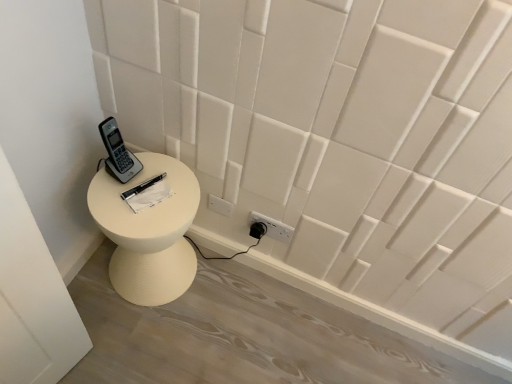
You are a GUI agent. You are given a task and a screenshot of the screen. Output one action in this format:
    pyautogui.click(x=<x>, y=<y>)
    Task: Click on the white paper at center
    
    Given the screenshot: What is the action you would take?
    pyautogui.click(x=149, y=196)

Describe the element at coordinates (148, 232) in the screenshot. The height and width of the screenshot is (384, 512). I see `white matte side table at lower left` at that location.

The image size is (512, 384). I want to click on white paper at center, so click(x=149, y=196).

From the image's perspective, which is below, gray plastic phone at upper left or white paper at center?

white paper at center is shown below in the image.

From a real-world perspective, who is located lower, gray plastic phone at upper left or white paper at center?

From a 3D spatial view, white paper at center is below.

Considering the sizes of objects gray plastic phone at upper left and white paper at center in the image provided, who is thinner, gray plastic phone at upper left or white paper at center?

gray plastic phone at upper left.

Considering the sizes of objects white paper at center and gray plastic phone at upper left in the image provided, who is shorter, white paper at center or gray plastic phone at upper left?

Standing shorter between the two is white paper at center.

Considering the sizes of objects white paper at center and gray plastic phone at upper left in the image provided, who is wider, white paper at center or gray plastic phone at upper left?

With larger width is white paper at center.

From a real-world perspective, is white paper at center beneath gray plastic phone at upper left?

Yes, from a real-world perspective, white paper at center is below gray plastic phone at upper left.

Is white paper at center oriented towards gray plastic phone at upper left?

No, white paper at center is not facing towards gray plastic phone at upper left.

I want to click on notepad that appears above the white matte side table at lower left (from the image's perspective), so click(149, 196).

Which is closer, (145, 194) or (185, 175)?

The point (145, 194) is closer to the camera.

From a real-world perspective, which is physically below, white paper at center or white matte side table at lower left?

From a 3D spatial view, white matte side table at lower left is below.

Which of these two, white matte side table at lower left or gray plastic phone at upper left, stands taller?

white matte side table at lower left.

From the image's perspective, between white matte side table at lower left and gray plastic phone at upper left, which one is located above?

gray plastic phone at upper left appears higher in the image.

Which object is more forward, white matte side table at lower left or gray plastic phone at upper left?

gray plastic phone at upper left is more forward.

Which object is positioned more to the right, white matte side table at lower left or gray plastic phone at upper left?

From the viewer's perspective, white matte side table at lower left appears more on the right side.

Looking at this image, from the image's perspective, which is below, white matte side table at lower left or white paper at center?

white matte side table at lower left, from the image's perspective.

Considering the sizes of white matte side table at lower left and white paper at center in the image, is white matte side table at lower left bigger or smaller than white paper at center?

Considering their sizes, white matte side table at lower left takes up more space than white paper at center.

Considering the relative sizes of white matte side table at lower left and white paper at center in the image provided, is white matte side table at lower left thinner than white paper at center?

No, white matte side table at lower left is not thinner than white paper at center.

Is white matte side table at lower left directly adjacent to white paper at center?

No, white matte side table at lower left is not touching white paper at center.

Locate an element on the screen. furniture below the gray plastic phone at upper left (from a real-world perspective) is located at coordinates pyautogui.click(x=148, y=232).

Is there a large distance between gray plastic phone at upper left and white matte side table at lower left?

That's not correct — gray plastic phone at upper left is a little close to white matte side table at lower left.

Does point (131, 174) come farther from viewer compared to point (196, 188)?

No, (131, 174) is closer to viewer.

The image size is (512, 384). In order to click on notepad below the gray plastic phone at upper left (from a real-world perspective) in this screenshot , I will do `click(149, 196)`.

Where is `control above the white paper at center (from the image's perspective)`? control above the white paper at center (from the image's perspective) is located at coordinates (118, 153).

Which object lies nearer to the anchor point gray plastic phone at upper left, white paper at center or white matte side table at lower left?

white paper at center lies closer to gray plastic phone at upper left than the other object.

From the picture: From the image, which object appears to be farther from white matte side table at lower left, gray plastic phone at upper left or white paper at center?

Among the two, gray plastic phone at upper left is located further to white matte side table at lower left.

From the image, which object appears to be nearer to gray plastic phone at upper left, white matte side table at lower left or white paper at center?

white paper at center.

Looking at the image, which one is located further to white matte side table at lower left, white paper at center or gray plastic phone at upper left?

gray plastic phone at upper left is positioned further to the anchor white matte side table at lower left.

Estimate the real-world distances between objects in this image. Which object is further from white paper at center, gray plastic phone at upper left or white matte side table at lower left?

The object further to white paper at center is white matte side table at lower left.

From the image, which object appears to be nearer to white paper at center, white matte side table at lower left or gray plastic phone at upper left?

Based on the image, gray plastic phone at upper left appears to be nearer to white paper at center.

The width and height of the screenshot is (512, 384). I want to click on notepad between gray plastic phone at upper left and white matte side table at lower left from top to bottom, so click(x=149, y=196).